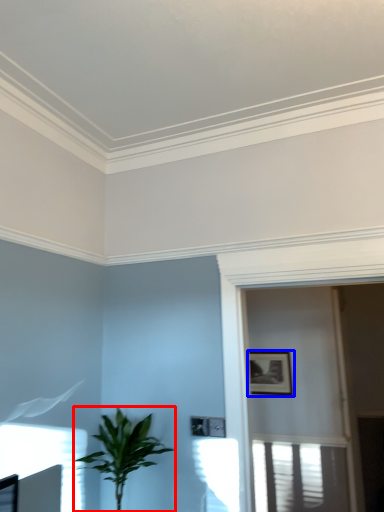
Question: Among these objects, which one is farthest to the camera, houseplant (highlighted by a red box) or picture frame (highlighted by a blue box)?

Choices:
 (A) houseplant
 (B) picture frame

Answer: (B)